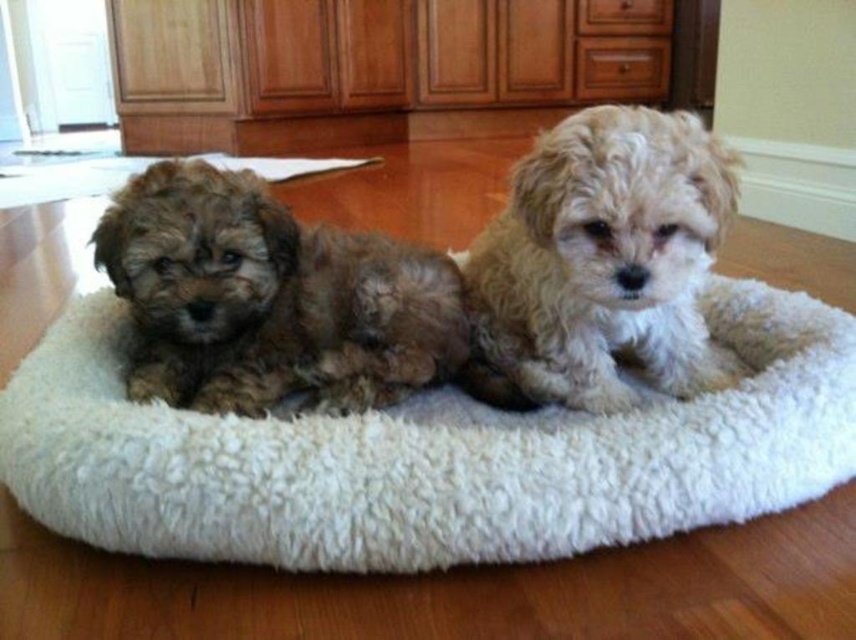
Question: Does white fluffy dog bed at center have a greater width compared to fuzzy beige dog at center?

Choices:
 (A) yes
 (B) no

Answer: (A)

Question: Which object is the closest to the white fluffy dog bed at center?

Choices:
 (A) fuzzy brown dog at left
 (B) fuzzy beige dog at center

Answer: (A)

Question: Can you confirm if white fluffy dog bed at center is positioned below fuzzy brown dog at left?

Choices:
 (A) yes
 (B) no

Answer: (A)

Question: Which point is closer to the camera?

Choices:
 (A) (675, 140)
 (B) (119, 230)
 (C) (491, 468)

Answer: (C)

Question: Considering the relative positions of fuzzy brown dog at left and fuzzy beige dog at center in the image provided, where is fuzzy brown dog at left located with respect to fuzzy beige dog at center?

Choices:
 (A) above
 (B) below

Answer: (B)

Question: Which of the following is the farthest from the observer?

Choices:
 (A) (480, 346)
 (B) (194, 170)
 (C) (533, 545)

Answer: (A)